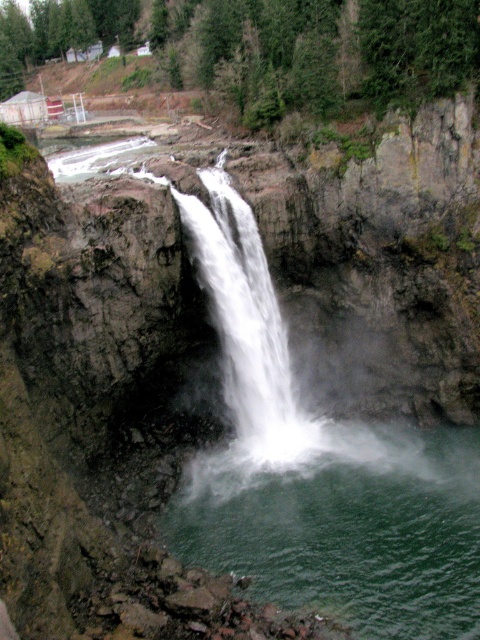
Question: Is green liquid at center bigger than white frothy water at center?

Choices:
 (A) yes
 (B) no

Answer: (A)

Question: Is green liquid at center positioned behind white frothy water at center?

Choices:
 (A) no
 (B) yes

Answer: (A)

Question: Which of the following is the closest to the observer?

Choices:
 (A) white frothy water at center
 (B) green liquid at center

Answer: (B)

Question: Can you confirm if green liquid at center is positioned below white frothy water at center?

Choices:
 (A) no
 (B) yes

Answer: (B)